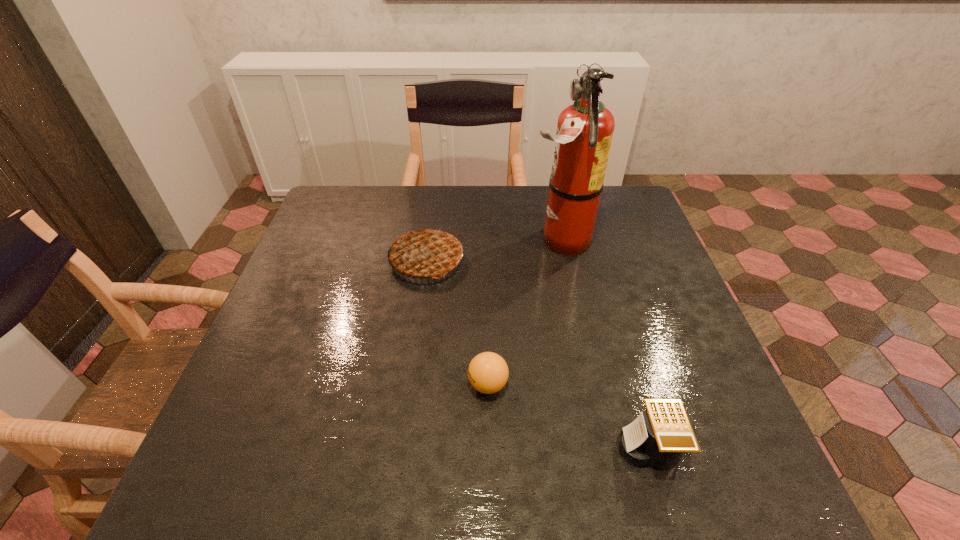
Where is `fire extinguisher`? This screenshot has height=540, width=960. fire extinguisher is located at coordinates (585, 129).

At what (x,y) coordinates should I click in order to perform the action: click on the leftmost object. Please return your answer as a coordinate pair (x, y). This screenshot has height=540, width=960. Looking at the image, I should click on (426, 253).

The height and width of the screenshot is (540, 960). In order to click on pie in this screenshot , I will do `click(426, 253)`.

Find the location of `the nearest object`. the nearest object is located at coordinates (659, 439).

Find the location of a particular element. the second nearest object is located at coordinates (488, 372).

You are a GUI agent. You are given a task and a screenshot of the screen. Output one action in this format:
    pyautogui.click(x=<x>, y=<y>)
    Task: Click on the second object from left to right
    
    Given the screenshot: What is the action you would take?
    pyautogui.click(x=488, y=372)

You are a GUI agent. You are given a task and a screenshot of the screen. Output one action in this format:
    pyautogui.click(x=<x>, y=<y>)
    Task: Click on the free space located from the nozzle of the fire extinguisher
    
    Given the screenshot: What is the action you would take?
    pyautogui.click(x=451, y=240)

Locate an element on the screen. The image size is (960, 540). free location located from the nozzle of the fire extinguisher is located at coordinates (466, 240).

At what (x,y) coordinates should I click in order to perform the action: click on free location located from the nozzle of the fire extinguisher. Please return your answer as a coordinate pair (x, y). Image resolution: width=960 pixels, height=540 pixels. Looking at the image, I should click on (404, 240).

Image resolution: width=960 pixels, height=540 pixels. Find the location of `vacant space located on the back of the third shortest object`. vacant space located on the back of the third shortest object is located at coordinates (432, 222).